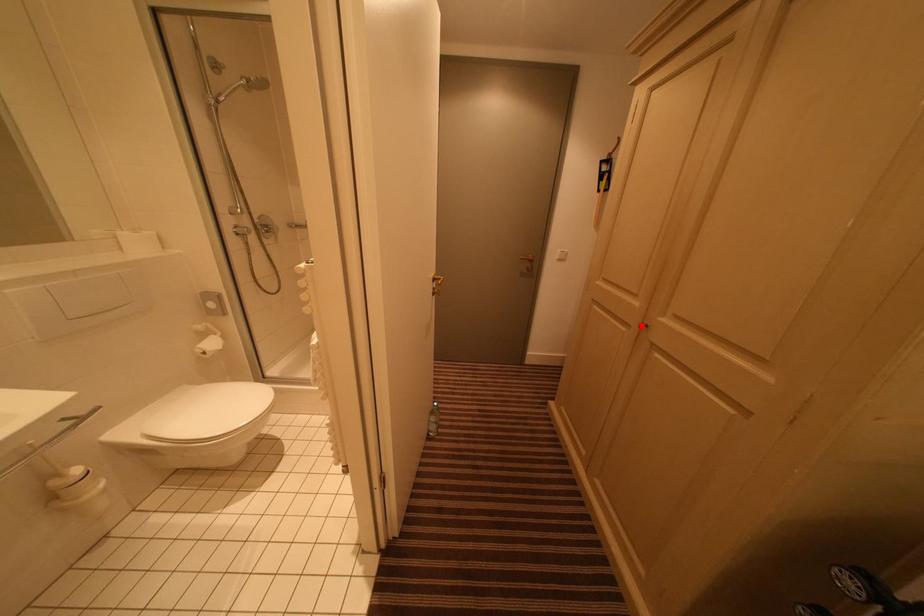
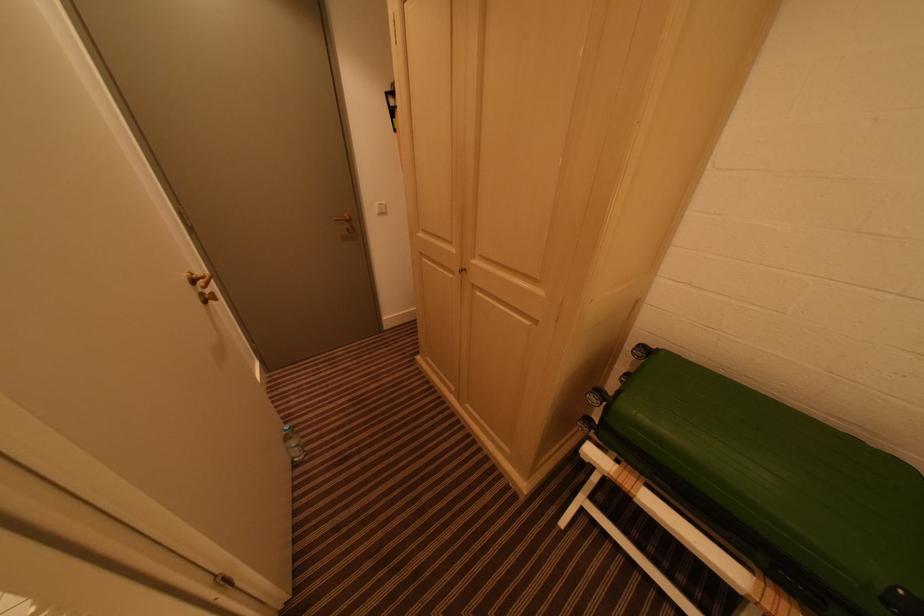
Find the pixel in the second image that matches the highlighted location in the first image.

(464, 272)